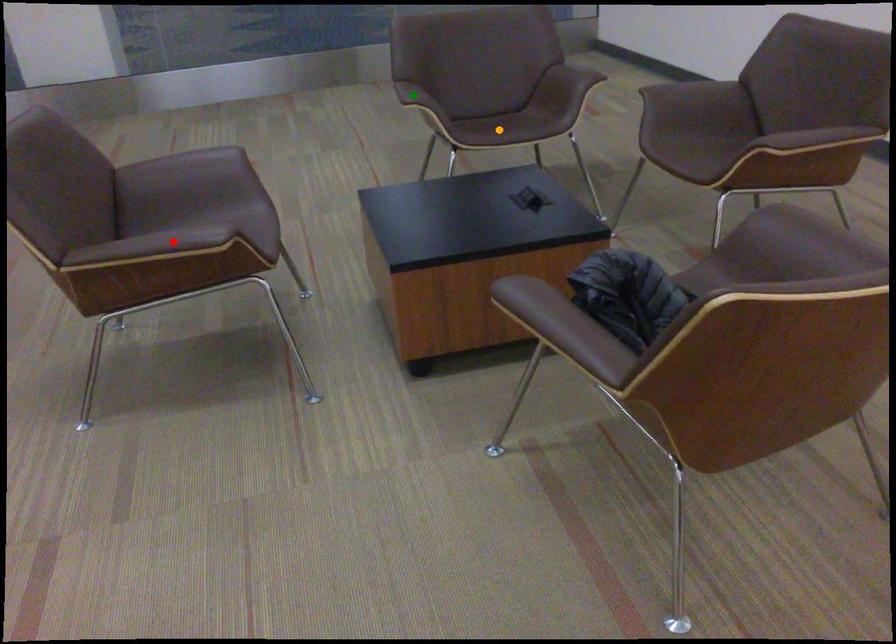
Order these from farthest to nearest:
orange point | red point | green point

green point
orange point
red point